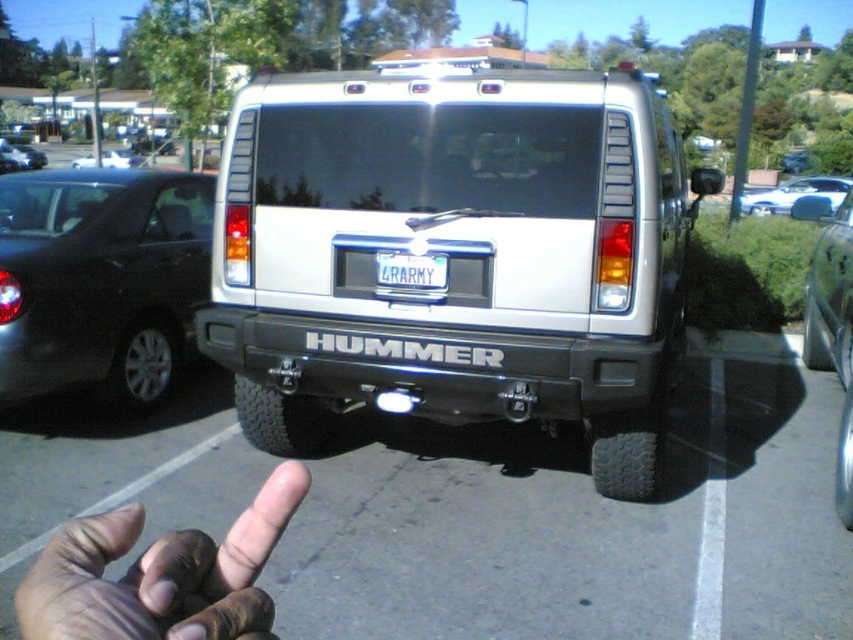
You are standing in front of the white Hummer vehicle. There are two points marked on the image. The first point is at coordinate point (x=781, y=198) and the second point is at coordinate point (x=44, y=163). Which point is closer to you?

Point (x=781, y=198) is closer to the viewer than point (x=44, y=163).

You are a parking attendant who needs to guide a delivery truck that is 10 meters long into a parking spot between the white glossy sedan at upper right and the shiny silver car at center. Can the truck fit between them without touching either vehicle?

The distance between the white glossy sedan at upper right and the shiny silver car at center is 28.86 meters. Since the delivery truck is only 10 meters long, there is more than enough space for it to fit between them without touching either vehicle.